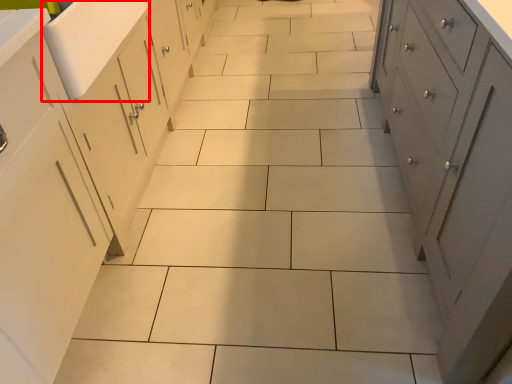
Question: Where is sink (annotated by the red box) located in relation to cupboard in the image?

Choices:
 (A) left
 (B) right

Answer: (A)